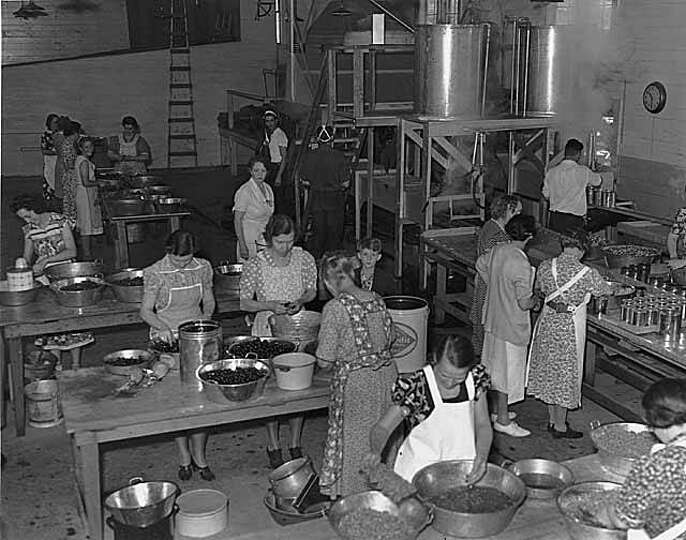
This screenshot has width=686, height=540. Find the location of `wall clock`. wall clock is located at coordinates (652, 96).